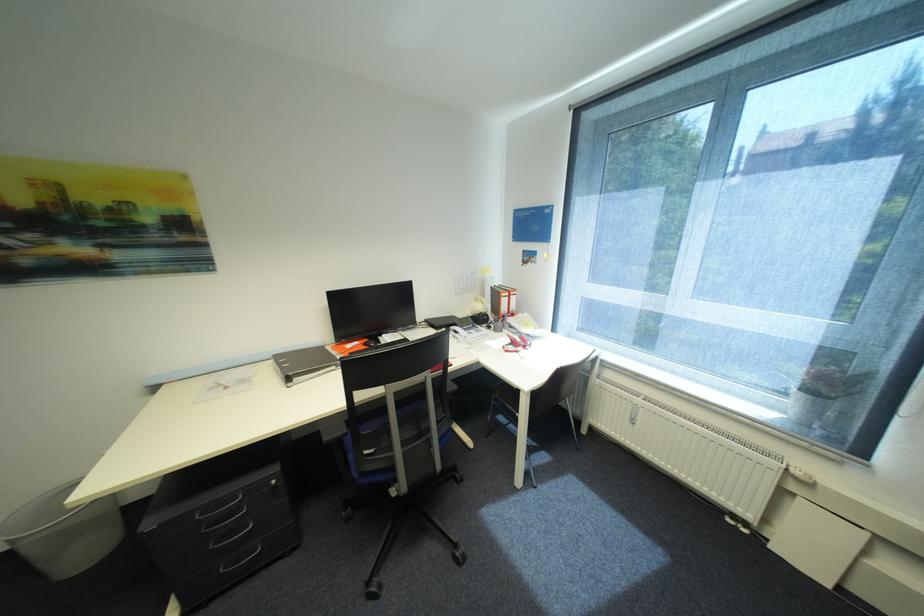
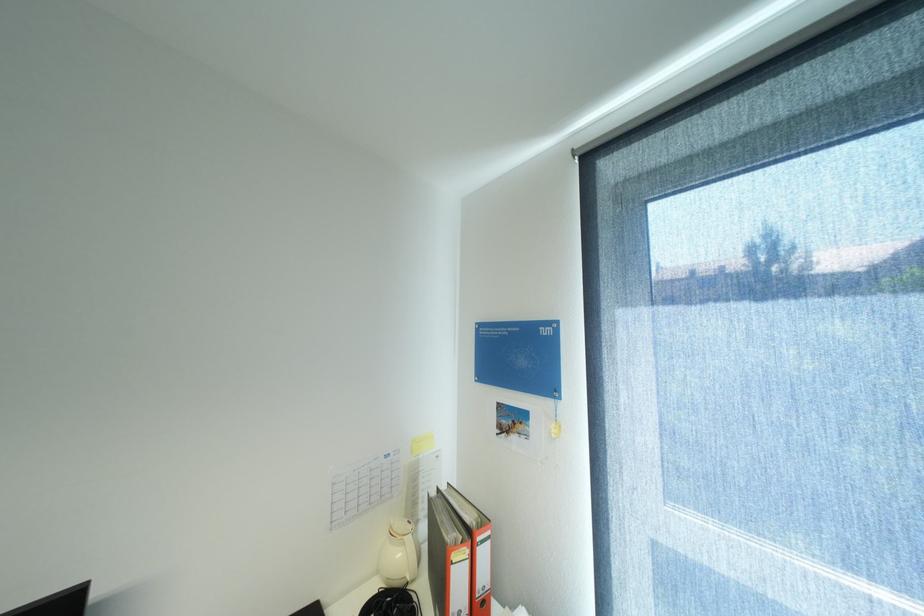
In the second image, find the point that corresponds to [488,307] in the first image.

(407, 554)